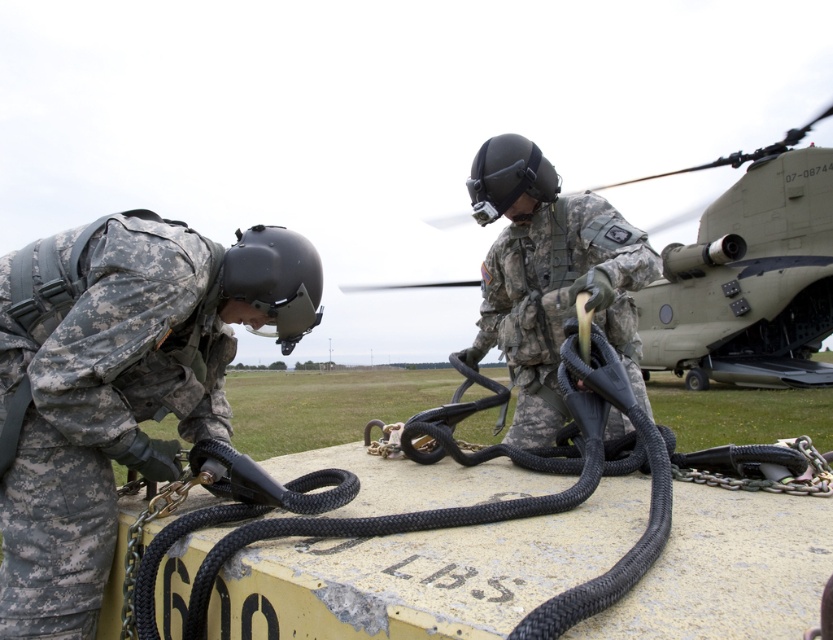
Question: Among these objects, which one is farthest from the camera?

Choices:
 (A) matte green helicopter at center
 (B) black braided rope at center

Answer: (A)

Question: Can you confirm if camouflage fabric helmet at upper center is bigger than matte green helicopter at center?

Choices:
 (A) no
 (B) yes

Answer: (A)

Question: Estimate the real-world distances between objects in this image. Which object is farther from the camouflage fabric helmet at center?

Choices:
 (A) black braided rope at center
 (B) camouflage fabric helmet at upper center

Answer: (B)

Question: Observing the image, what is the correct spatial positioning of black braided rope at center in reference to matte green helicopter at center?

Choices:
 (A) below
 (B) above

Answer: (A)

Question: Which object appears closest to the camera in this image?

Choices:
 (A) black braided rope at center
 (B) matte green helicopter at center
 (C) camouflage fabric helmet at center

Answer: (A)

Question: Where is camouflage fabric helmet at upper center located in relation to black braided rope at center in the image?

Choices:
 (A) left
 (B) right

Answer: (A)